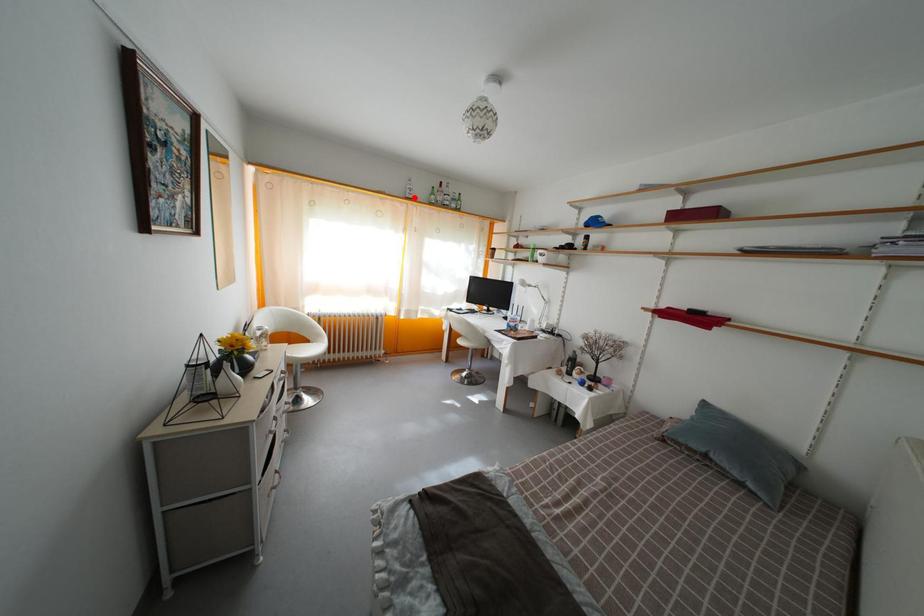
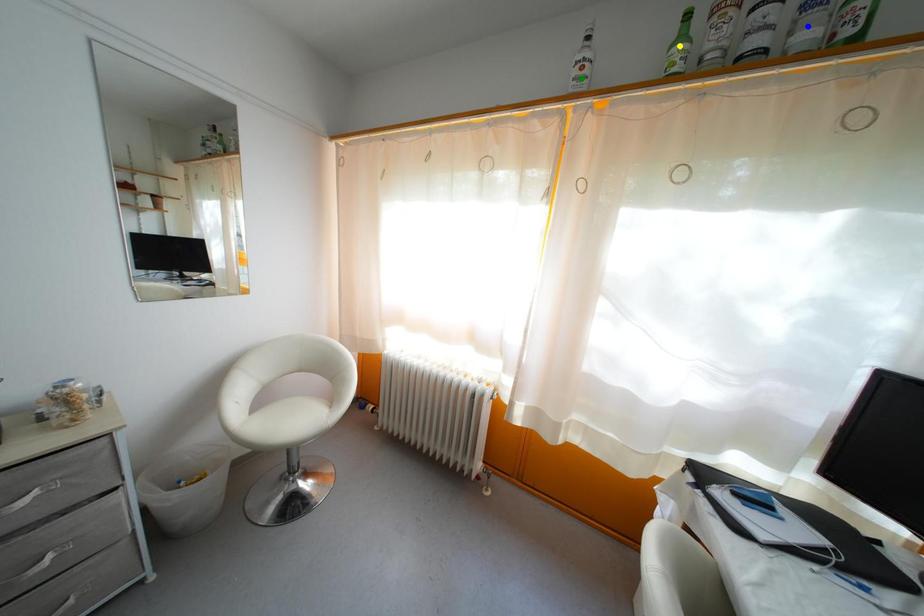
Question: I am providing you with two images of the same scene from different viewpoints. A red point is marked on the first image. You are given multiple points on the second image. In image 2, which mark is for the same physical point as the one in image 1?

Choices:
 (A) green point
 (B) yellow point
 (C) blue point

Answer: (A)